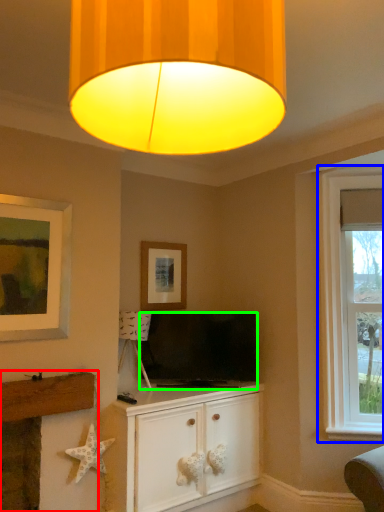
Question: Based on their relative distances, which object is nearer to fireplace (highlighted by a red box)? Choose from window (highlighted by a blue box) and television (highlighted by a green box).

Choices:
 (A) window
 (B) television

Answer: (B)